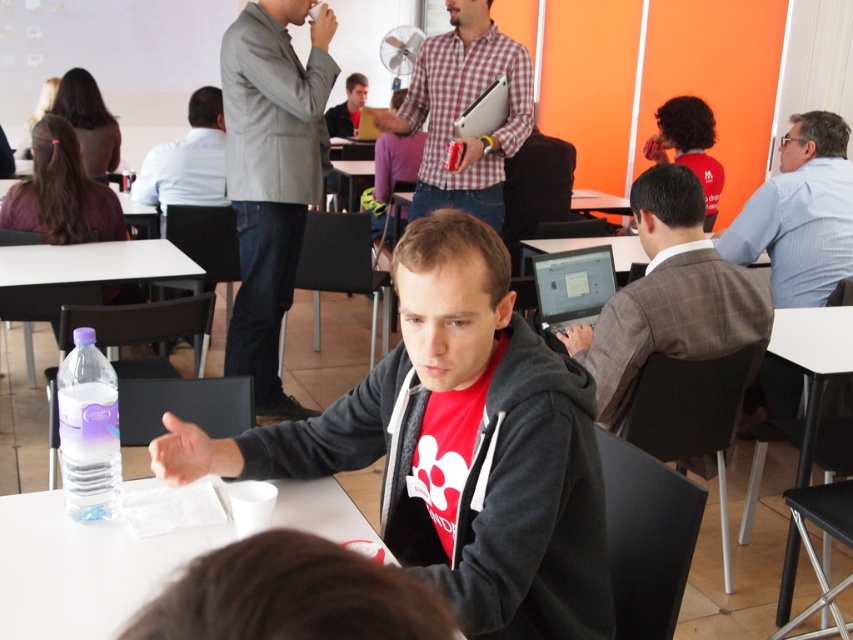
You are organizing a small workshop in this room and need to place a matte black laptop at center on the white plastic table at lower center. Will the laptop fit on the table?

The white plastic table at lower center is wider than the matte black laptop at center, so the laptop will fit on the table.

You are standing in the classroom and want to reach the point at coordinates (115,451). If you can walk 5 feet per second, how long will it take you to reach that point?

The distance of point (115,451) from camera is 4.70 feet. At a walking speed of 5 feet per second, it would take approximately 0.94 seconds to reach the point.